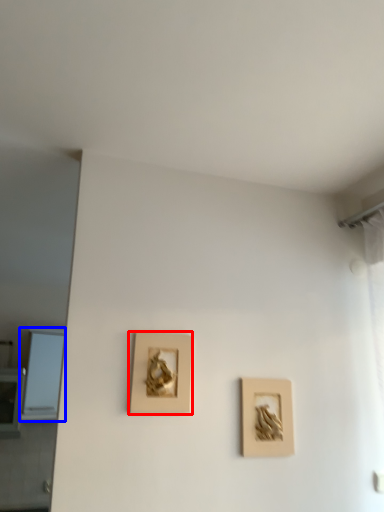
Question: Which object appears farthest to the camera in this image, picture frame (highlighted by a red box) or window (highlighted by a blue box)?

Choices:
 (A) picture frame
 (B) window

Answer: (B)